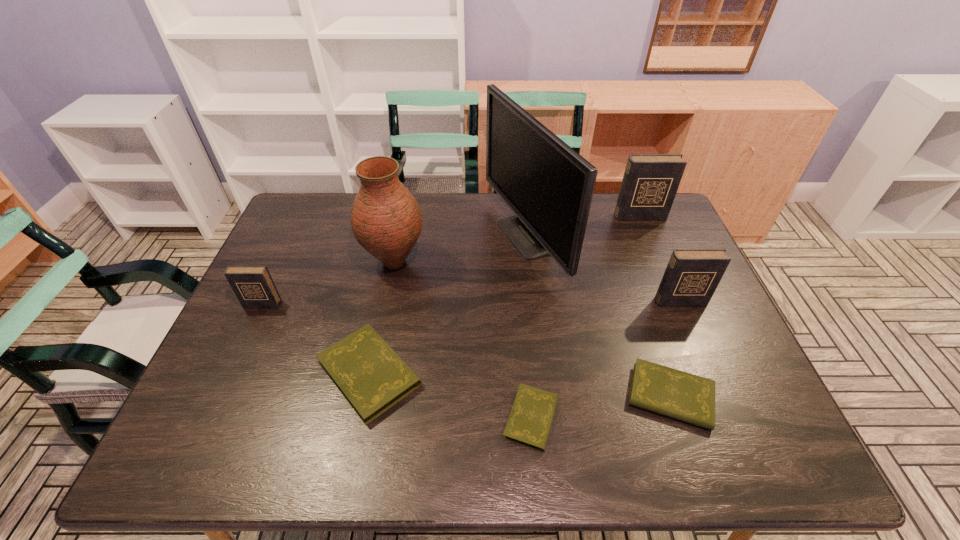
At what (x,y) coordinates should I click in order to perform the action: click on free space that satisfies the following two spatial constraints: 1. on the front cover of the sixth tallest object; 2. on the right side of the smallest dark diary. Please return your answer as a coordinate pair (x, y). Looking at the image, I should click on (229, 373).

I want to click on vacant position in the image that satisfies the following two spatial constraints: 1. on the front cover of the fourth diary from right to left; 2. on the left side of the third tallest diary, so click(x=209, y=418).